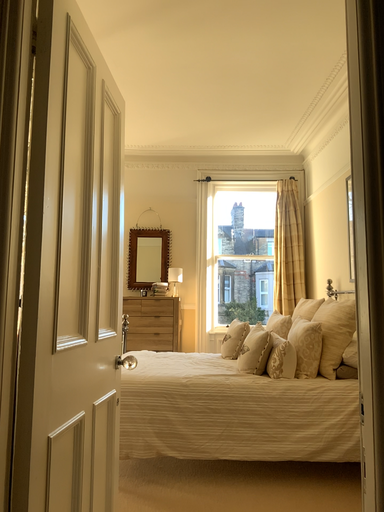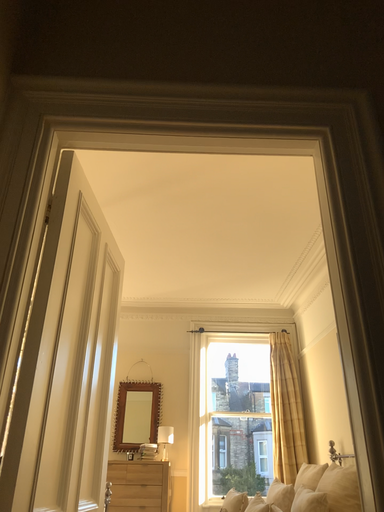
Question: How did the camera likely rotate when shooting the video?

Choices:
 (A) rotated upward
 (B) rotated downward

Answer: (A)